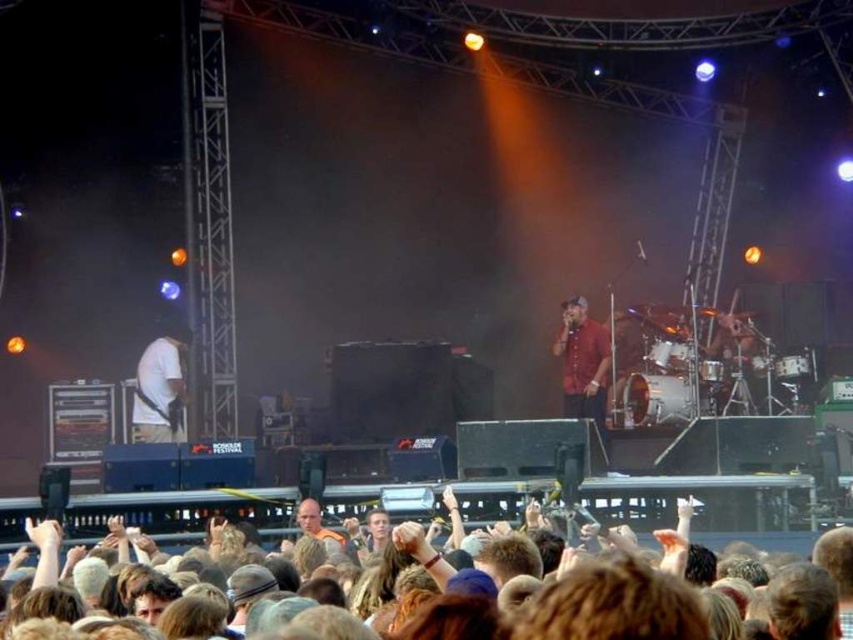
Does red matte shirt at center appear under white matte guitar at left?

No.

At what (x,y) coordinates should I click in order to perform the action: click on red matte shirt at center. Please return your answer as a coordinate pair (x, y). This screenshot has height=640, width=853. Looking at the image, I should click on (582, 362).

Is brown hair at lower center thinner than white matte guitar at left?

No.

Does point (619, 508) come behind point (149, 410)?

That is False.

Image resolution: width=853 pixels, height=640 pixels. I want to click on brown hair at lower center, so click(683, 484).

Is brown hair at lower center thinner than red matte shirt at center?

In fact, brown hair at lower center might be wider than red matte shirt at center.

Is brown hair at lower center to the right of red matte shirt at center from the viewer's perspective?

Incorrect, brown hair at lower center is not on the right side of red matte shirt at center.

Is point (109, 497) positioned in front of point (575, 401)?

Yes, it is in front of point (575, 401).

You are a GUI agent. You are given a task and a screenshot of the screen. Output one action in this format:
    pyautogui.click(x=<x>, y=<y>)
    Task: Click on the brown hair at lower center
    The image size is (853, 640).
    Given the screenshot: What is the action you would take?
    pyautogui.click(x=683, y=484)